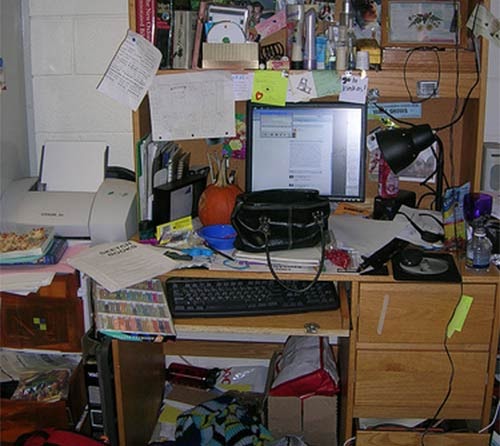
Identify the location of cds. (233, 33).